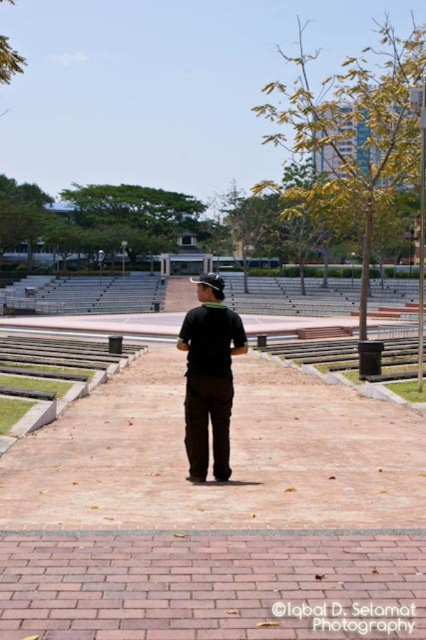
Question: Which of the following is the closest to the observer?

Choices:
 (A) brown brick path at center
 (B) black matte shirt at center

Answer: (A)

Question: Is brown brick path at center further to the viewer compared to black matte shirt at center?

Choices:
 (A) no
 (B) yes

Answer: (A)

Question: Can you confirm if brown brick path at center is wider than black matte shirt at center?

Choices:
 (A) no
 (B) yes

Answer: (B)

Question: Is the position of brown brick path at center more distant than that of black matte shirt at center?

Choices:
 (A) no
 (B) yes

Answer: (A)

Question: Which object appears farthest from the camera in this image?

Choices:
 (A) brown brick path at center
 (B) black matte shirt at center

Answer: (B)